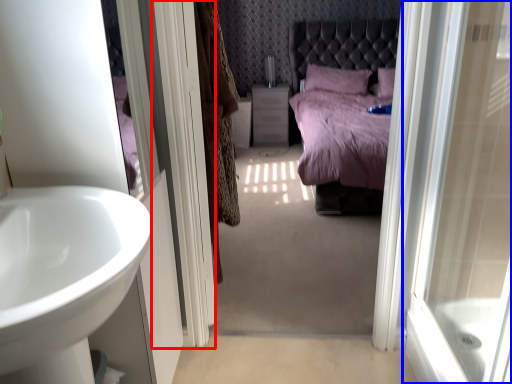
Question: Which point is further to the camera, screen door (highlighted by a red box) or door (highlighted by a blue box)?

Choices:
 (A) screen door
 (B) door

Answer: (A)